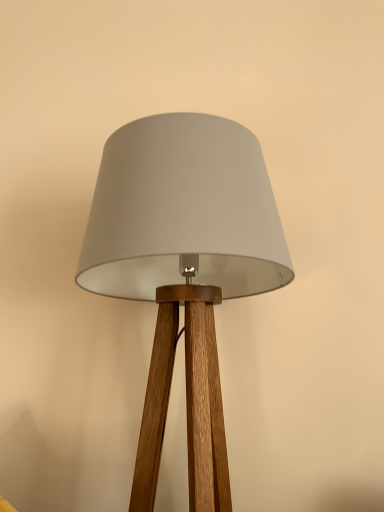
Where is `wooden tripod lamp at center`? wooden tripod lamp at center is located at coordinates (184, 268).

What is the approximate width of wooden tripod lamp at center?

It is 17.57 inches.

Describe the element at coordinates (184, 268) in the screenshot. I see `wooden tripod lamp at center` at that location.

Identify the location of wooden tripod lamp at center. (184, 268).